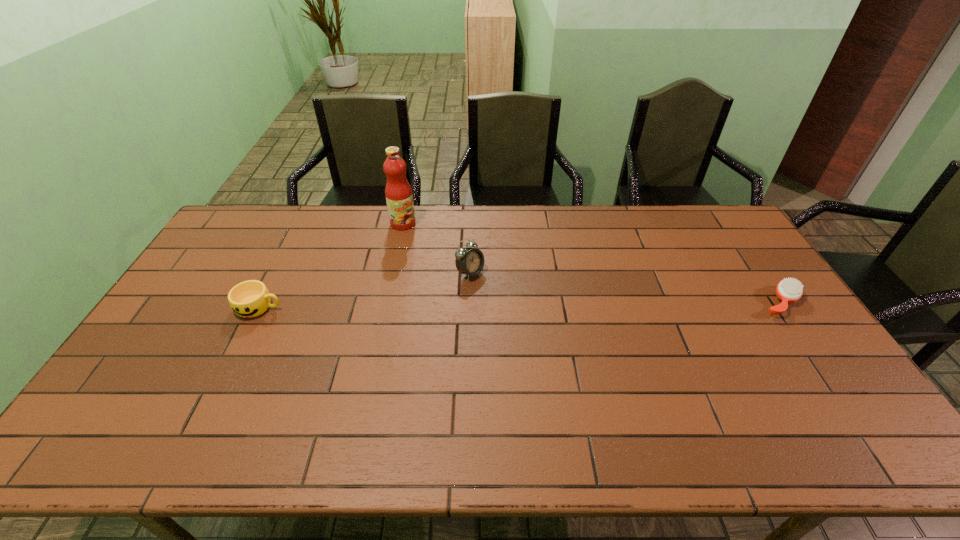
Identify the location of the leftmost object. (248, 299).

The height and width of the screenshot is (540, 960). Identify the location of the second shortest object. click(x=248, y=299).

The image size is (960, 540). What are the coordinates of `the rightmost object` in the screenshot? It's located at point(788,290).

Where is `hairbrush`? This screenshot has width=960, height=540. hairbrush is located at coordinates (788, 290).

Locate an element on the screen. This screenshot has height=540, width=960. the tallest object is located at coordinates (398, 192).

Where is `the farthest object`? the farthest object is located at coordinates (398, 192).

In order to click on the third nearest object in this screenshot , I will do `click(470, 261)`.

You are a GUI agent. You are given a task and a screenshot of the screen. Output one action in this format:
    pyautogui.click(x=<x>, y=<y>)
    Task: Click on the third object from left to right
    
    Given the screenshot: What is the action you would take?
    pyautogui.click(x=470, y=261)

In order to click on vacant region located 0.090m on the back of the cup in this screenshot , I will do `click(276, 275)`.

Find the location of `free location located 0.390m on the left of the rightmost object`. free location located 0.390m on the left of the rightmost object is located at coordinates (630, 302).